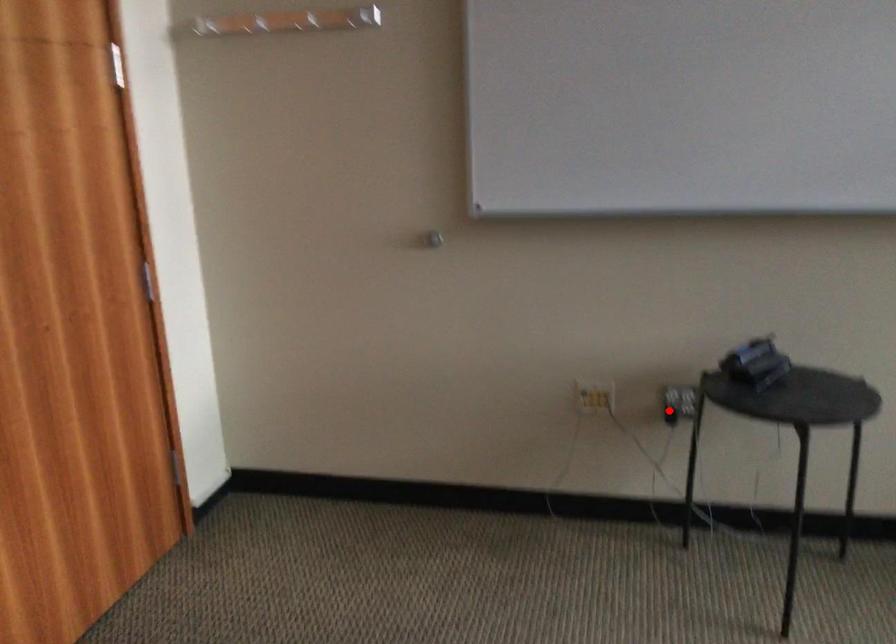
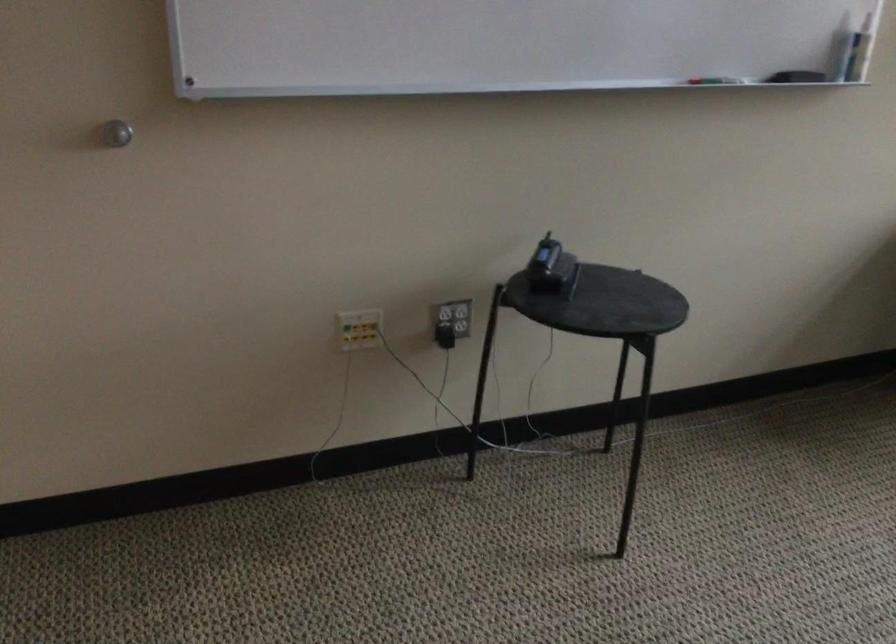
The point at the highlighted location is marked in the first image. Where is the corresponding point in the second image?

(444, 336)